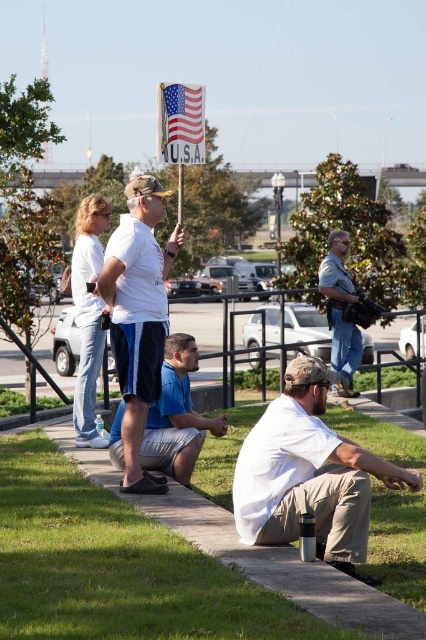
Is white cotton t-shirt at center in front of denim jeans at center?

Yes, it is.

Measure the distance from white cotton t-shirt at center to denim jeans at center.

The distance of white cotton t-shirt at center from denim jeans at center is 22.12 feet.

The image size is (426, 640). Find the location of `white cotton t-shirt at center`. white cotton t-shirt at center is located at coordinates (138, 316).

Where is `white cotton t-shirt at center`? white cotton t-shirt at center is located at coordinates (138, 316).

Is green grass at lower center to the right of white cotton t-shirt at center from the viewer's perspective?

Yes, green grass at lower center is to the right of white cotton t-shirt at center.

Does green grass at lower center have a greater width compared to white cotton t-shirt at center?

Yes, green grass at lower center is wider than white cotton t-shirt at center.

Who is more distant from viewer, (x=118, y=632) or (x=126, y=486)?

Positioned behind is point (x=126, y=486).

Find the location of a particular element. Image resolution: width=426 pixels, height=640 pixels. green grass at lower center is located at coordinates (115, 566).

Who is positioned more to the right, green grass at lower center or denim jeans at center?

denim jeans at center

Identify the location of green grass at lower center. (x=115, y=566).